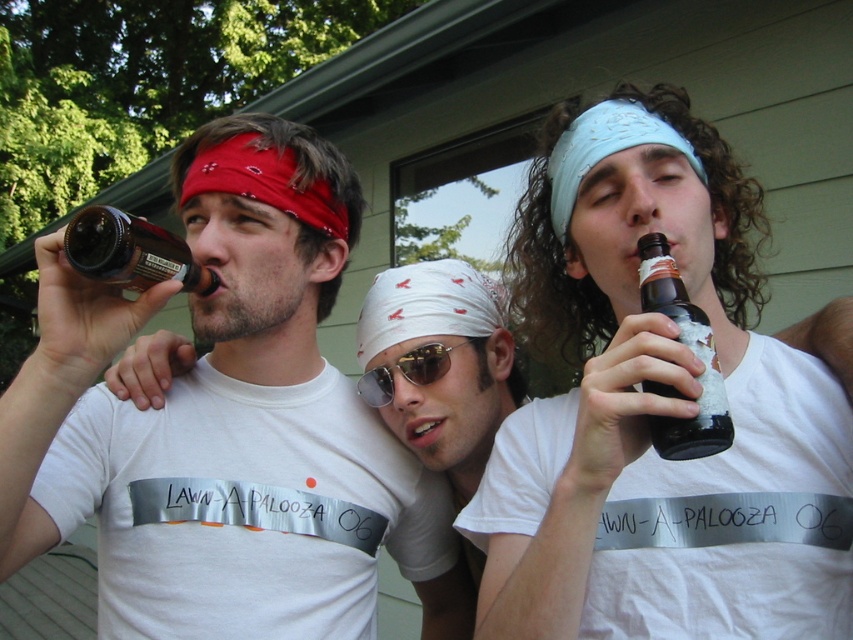
You are a bartender at a party and need to place the matte black bottle at left and the dark brown glass bottle at right on a shelf that is 24 inches wide. Can both bottles fit side by side on the shelf without overlapping?

The matte black bottle at left is 22.72 inches from the dark brown glass bottle at right. Since the shelf is 24 inches wide, there is enough space to place both bottles side by side without overlapping as the total distance between them is less than the shelf width.

You are at a party and want to grab a drink. You see a matte black bottle at left and a dark brown glass bottle at right. Which bottle is closer to you?

The matte black bottle at left is closer to you because it is further to the viewer than the dark brown glass bottle at right.

You are at a party and see two bottles, a matte black bottle at left and a matte brown glass bottle at left. Which one could potentially hold more liquid based on their size?

The matte black bottle at left might be wider than the matte brown glass bottle at left, so it could potentially hold more liquid.